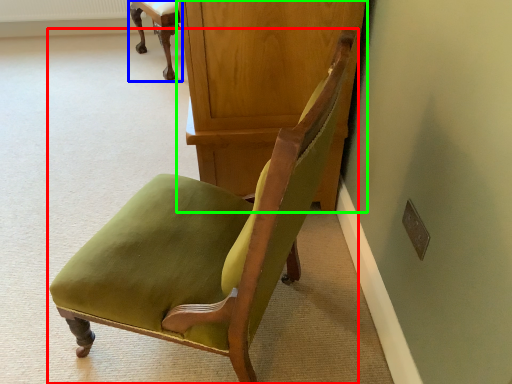
Question: Which object is positioned closest to chair (highlighted by a red box)? Select from chair (highlighted by a blue box) and dresser (highlighted by a green box).

Choices:
 (A) chair
 (B) dresser

Answer: (B)